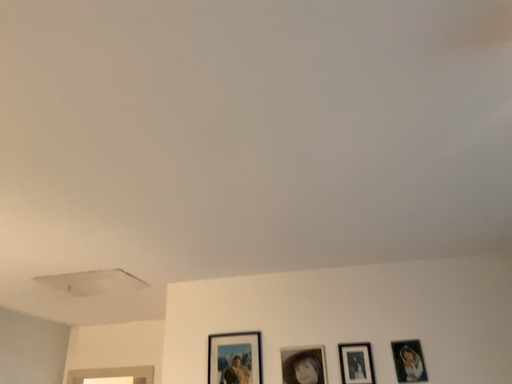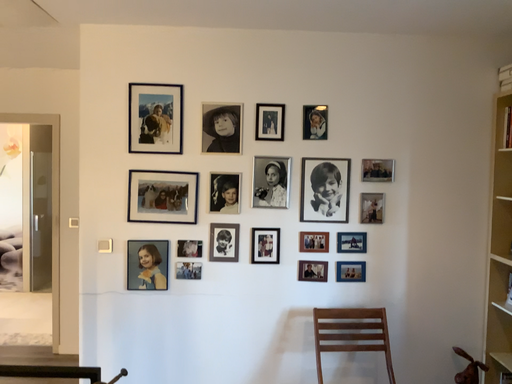
Question: Which way did the camera rotate in the video?

Choices:
 (A) rotated left
 (B) rotated right

Answer: (B)